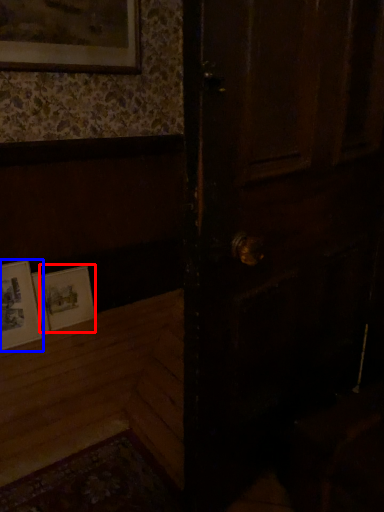
Question: Which object is further to the camera taking this photo, picture frame (highlighted by a red box) or picture frame (highlighted by a blue box)?

Choices:
 (A) picture frame
 (B) picture frame

Answer: (A)